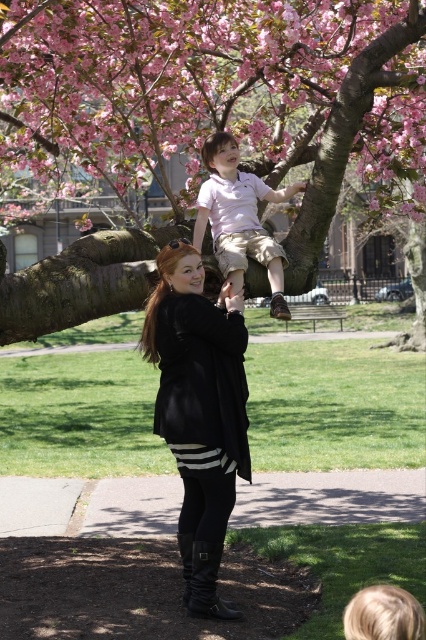
Who is more forward, (207, 369) or (210, 141)?

Positioned in front is point (207, 369).

Looking at this image, which of these two, black leather boots at lower center or light pink cotton shirt at upper center, stands shorter?

Standing shorter between the two is light pink cotton shirt at upper center.

Is point (180, 269) positioned behind point (236, 221)?

No, (180, 269) is closer to viewer.

Locate an element on the screen. The height and width of the screenshot is (640, 426). black leather boots at lower center is located at coordinates (198, 412).

Who is higher up, pink blossom tree at upper center or black leather boots at lower center?

pink blossom tree at upper center

Is point (221, 44) closer to viewer compared to point (198, 536)?

No, it is not.

Between point (382, 168) and point (190, 304), which one is positioned in front?

Positioned in front is point (190, 304).

Identify the location of pink blossom tree at upper center. The image size is (426, 640). (230, 129).

Does pink blossom tree at upper center have a lesser height compared to light pink cotton shirt at upper center?

No, pink blossom tree at upper center is not shorter than light pink cotton shirt at upper center.

Which is below, pink blossom tree at upper center or light pink cotton shirt at upper center?

light pink cotton shirt at upper center is below.

I want to click on pink blossom tree at upper center, so click(x=230, y=129).